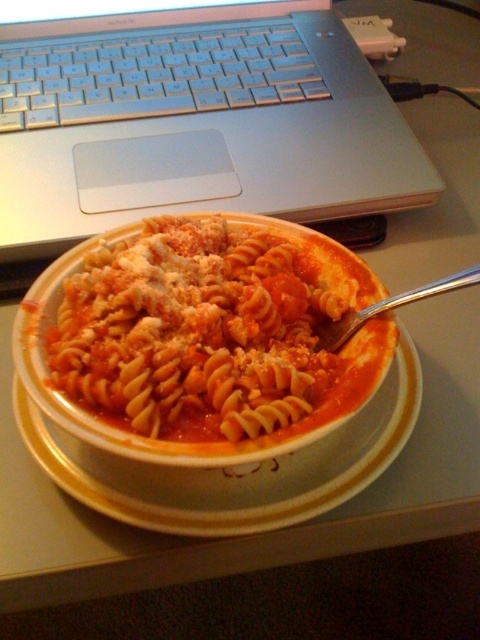
Question: Can you confirm if white ceramic bowl at center is wider than silver metallic fork at upper center?

Choices:
 (A) no
 (B) yes

Answer: (B)

Question: Does silver metallic laptop at upper left appear under matte tomato sauce pasta at center?

Choices:
 (A) no
 (B) yes

Answer: (A)

Question: Which point appears farthest from the camera in this image?

Choices:
 (A) click(x=147, y=525)
 (B) click(x=379, y=305)
 (C) click(x=396, y=132)

Answer: (C)

Question: Is silver metallic laptop at upper left below silver metallic fork at upper center?

Choices:
 (A) yes
 (B) no

Answer: (B)

Question: Which object is farther from the camera taking this photo?

Choices:
 (A) matte tomato sauce pasta at center
 (B) white ceramic bowl at center
 (C) silver metallic fork at upper center
 (D) silver metallic laptop at upper left

Answer: (D)

Question: Based on their relative distances, which object is farther from the white ceramic bowl at center?

Choices:
 (A) silver metallic fork at upper center
 (B) silver metallic laptop at upper left
 (C) matte tomato sauce pasta at center

Answer: (B)